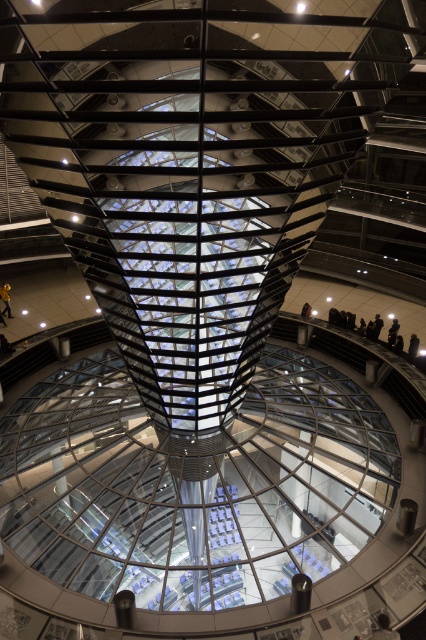
Does point (8, 308) come closer to viewer compared to point (416, 333)?

No, (8, 308) is behind (416, 333).

Is yellow jacket at center positioned before black leather jacket at upper center?

No, yellow jacket at center is behind black leather jacket at upper center.

What do you see at coordinates (5, 298) in the screenshot? The height and width of the screenshot is (640, 426). I see `yellow jacket at center` at bounding box center [5, 298].

Where is `yellow jacket at center`? The width and height of the screenshot is (426, 640). yellow jacket at center is located at coordinates point(5,298).

Between dark brown leather jacket at lower right and black leather jacket at center, which one has less height?

dark brown leather jacket at lower right is shorter.

Which of these two, dark brown leather jacket at lower right or black leather jacket at center, stands taller?

black leather jacket at center is taller.

Who is more distant from viewer, (379, 634) or (308, 304)?

Positioned behind is point (308, 304).

At what (x,y) coordinates should I click in order to perform the action: click on dark brown leather jacket at lower right. Please return your answer as a coordinate pair (x, y). Looking at the image, I should click on (383, 628).

Does point (5, 305) come farther from viewer compared to point (307, 310)?

That is True.

Describe the element at coordinates (5, 298) in the screenshot. I see `yellow jacket at center` at that location.

Where is `yellow jacket at center`? yellow jacket at center is located at coordinates (5, 298).